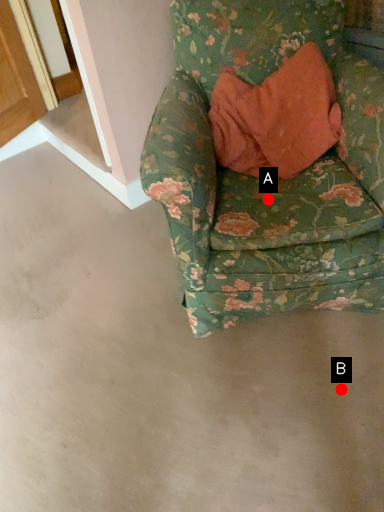
Question: Two points are circled on the image, labeled by A and B beside each circle. Which point is further to the camera?

Choices:
 (A) A is further
 (B) B is further

Answer: (A)